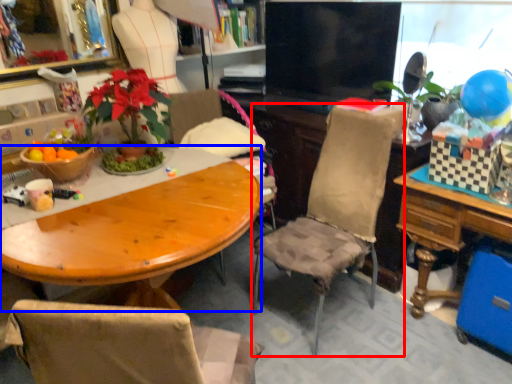
Question: Among these objects, which one is farthest to the camera, chair (highlighted by a red box) or desk (highlighted by a blue box)?

Choices:
 (A) chair
 (B) desk

Answer: (A)